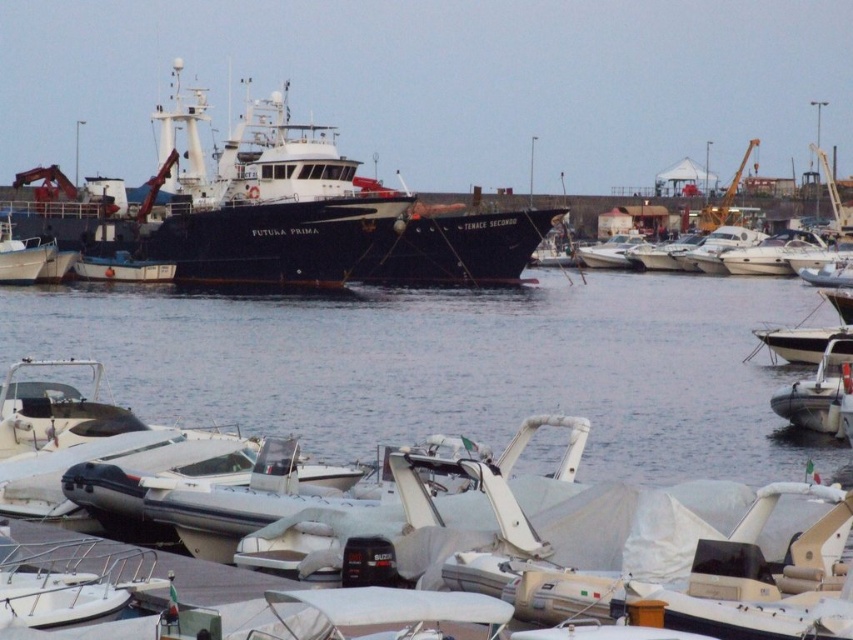
You are a harbor pilot who needs to guide a new boat into the marina. The black matte ship at center is anchored at point (274, 212). Can you safely navigate around it?

Yes, the black matte ship at center is anchored at point (274, 212), so you can safely navigate around it by maintaining a safe distance and following standard maritime protocols.

You are a dock worker who needs to retrieve the white rubber dinghy at lower right. The black matte ship at center is blocking your path. Can you move around the ship to access the dinghy?

The white rubber dinghy at lower right is behind the black matte ship at center, so you can move around the ship to access the dinghy.

Looking at this image, you are a dock worker who needs to ensure that the black matte ship at center and the white rubber dinghy at lower right can both fit through a narrow channel that is 10 meters wide. Based on their sizes, can both vessels pass through the channel simultaneously without touching each other?

The black matte ship at center might be wider than the white rubber dinghy at lower right, but without knowing their exact widths, it is uncertain if both can pass through the 10 meter channel simultaneously. The worker should verify the specific dimensions before proceeding.